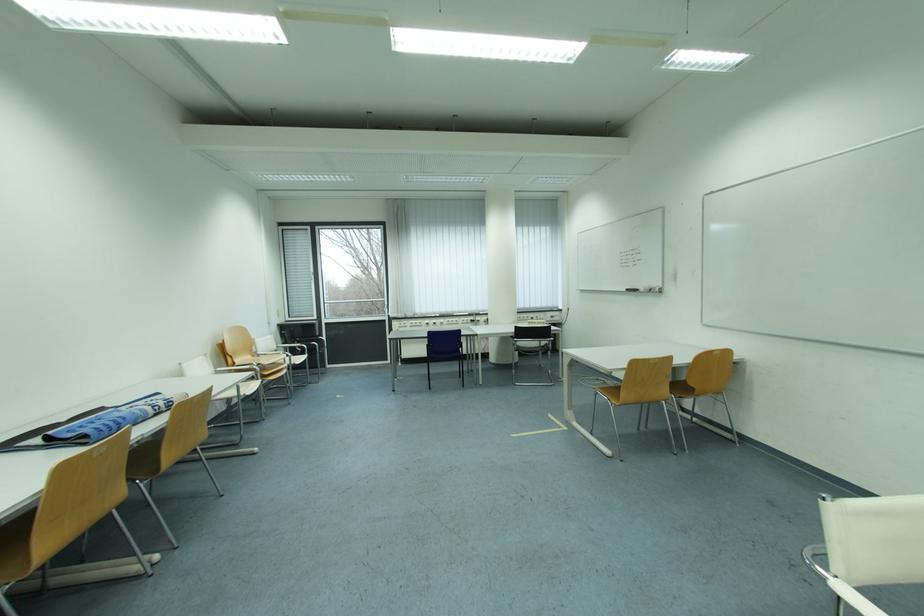
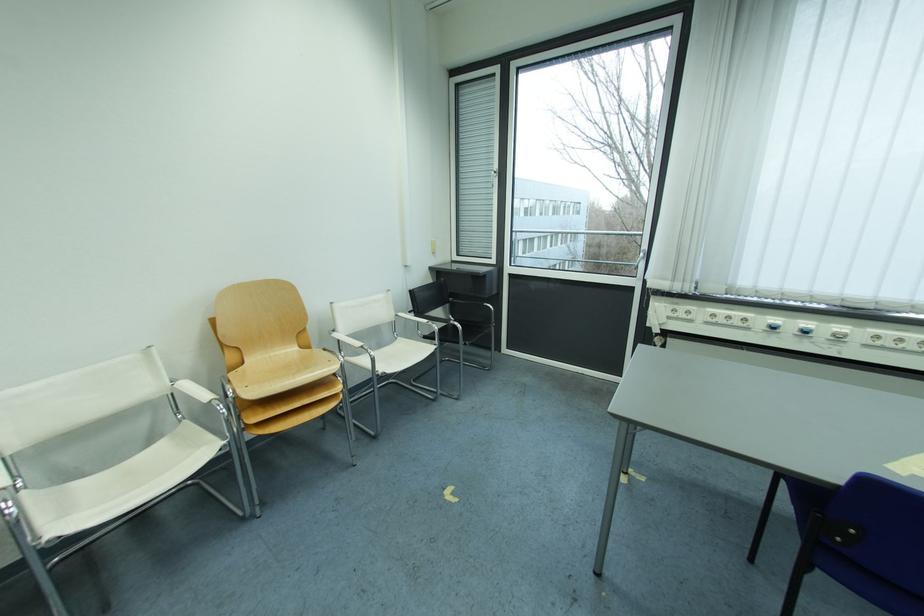
Where in the second image is the point corresponding to point 439,334 from the first image?

(883, 490)